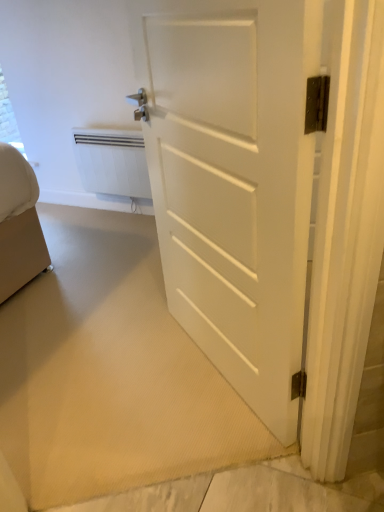
Question: Considering the relative sizes of white matte door at center and white matte radiator at upper left in the image provided, is white matte door at center wider than white matte radiator at upper left?

Choices:
 (A) no
 (B) yes

Answer: (B)

Question: Can you confirm if white matte door at center is bigger than white matte radiator at upper left?

Choices:
 (A) no
 (B) yes

Answer: (B)

Question: Does white matte door at center lie behind white matte radiator at upper left?

Choices:
 (A) no
 (B) yes

Answer: (A)

Question: Is the position of white matte door at center less distant than that of white matte radiator at upper left?

Choices:
 (A) yes
 (B) no

Answer: (A)

Question: Is white matte door at center next to white matte radiator at upper left and touching it?

Choices:
 (A) yes
 (B) no

Answer: (B)

Question: Is white matte door at center smaller than white matte radiator at upper left?

Choices:
 (A) yes
 (B) no

Answer: (B)

Question: Does white matte radiator at upper left appear on the right side of white matte door at center?

Choices:
 (A) yes
 (B) no

Answer: (B)

Question: From a real-world perspective, is white matte radiator at upper left under white matte door at center?

Choices:
 (A) no
 (B) yes

Answer: (B)

Question: Is the position of white matte radiator at upper left more distant than that of white matte door at center?

Choices:
 (A) no
 (B) yes

Answer: (B)

Question: From the image's perspective, would you say white matte radiator at upper left is shown under white matte door at center?

Choices:
 (A) no
 (B) yes

Answer: (A)

Question: Is white matte door at center inside white matte radiator at upper left?

Choices:
 (A) no
 (B) yes

Answer: (A)

Question: From a real-world perspective, is white matte radiator at upper left over white matte door at center?

Choices:
 (A) yes
 (B) no

Answer: (B)

Question: From the image's perspective, is white matte radiator at upper left located above or below white matte door at center?

Choices:
 (A) below
 (B) above

Answer: (B)